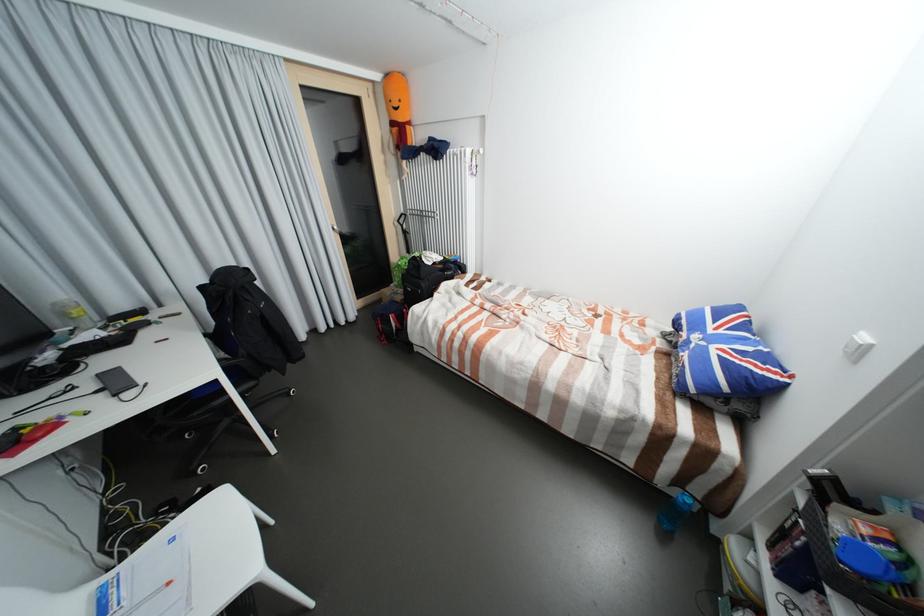
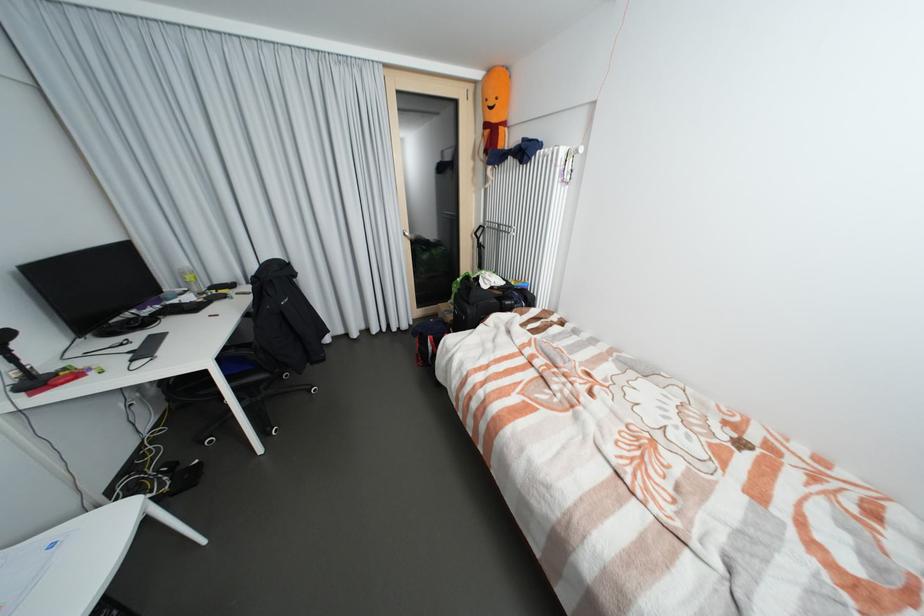
In the second image, find the point that corresponds to [399,124] in the first image.

(492, 126)